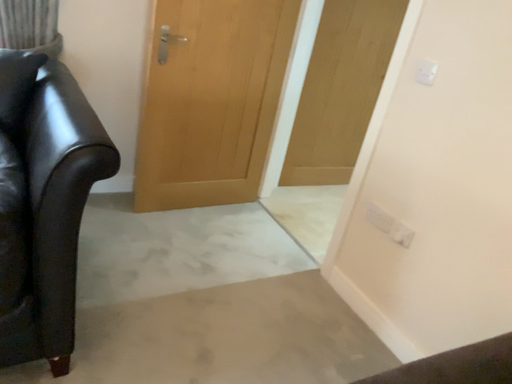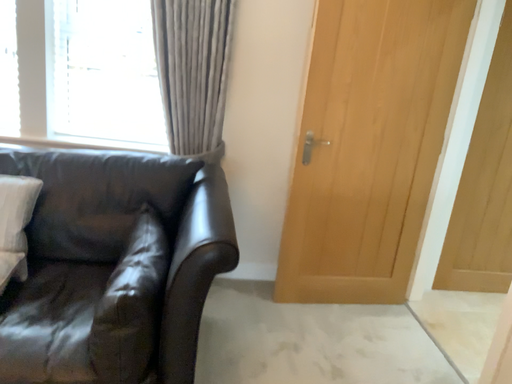
Question: How did the camera likely rotate when shooting the video?

Choices:
 (A) rotated left
 (B) rotated right

Answer: (A)